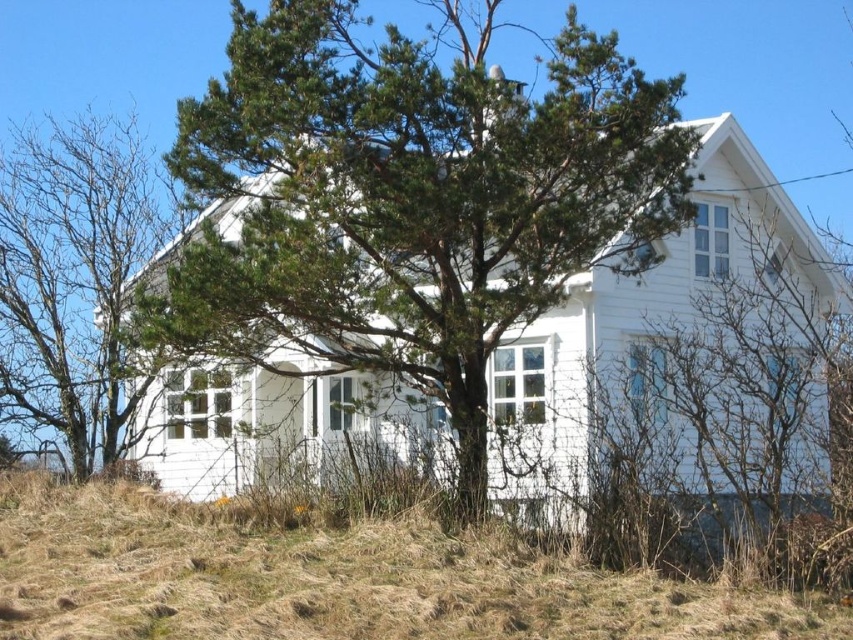
You are standing in front of the house and want to determine the relative positions of two points marked on the image. Which of the two points, point (398, 636) or point (109, 465), is closer to you?

Point (398, 636) is closer to the viewer than point (109, 465).